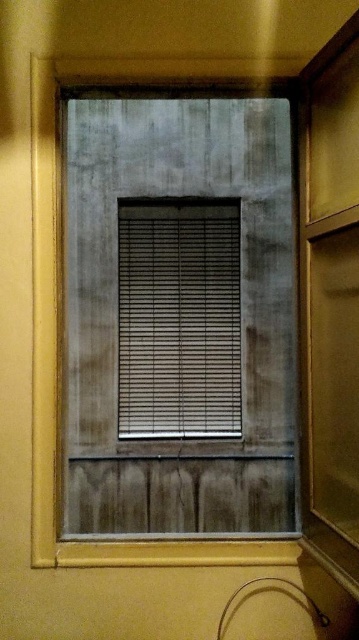
Question: Which of the following is the closest to the observer?

Choices:
 (A) (169, 426)
 (B) (268, 305)

Answer: (A)

Question: Which point is closer to the camera taking this photo?

Choices:
 (A) (232, 323)
 (B) (230, 264)

Answer: (A)

Question: Can you confirm if matte gray window at center is thinner than matte gray blinds at center?

Choices:
 (A) no
 (B) yes

Answer: (A)

Question: Can you confirm if matte gray window at center is positioned to the left of matte gray blinds at center?

Choices:
 (A) yes
 (B) no

Answer: (B)

Question: Does matte gray window at center appear under matte gray blinds at center?

Choices:
 (A) no
 (B) yes

Answer: (A)

Question: Which of the following is the farthest from the observer?

Choices:
 (A) matte gray window at center
 (B) matte gray blinds at center

Answer: (B)